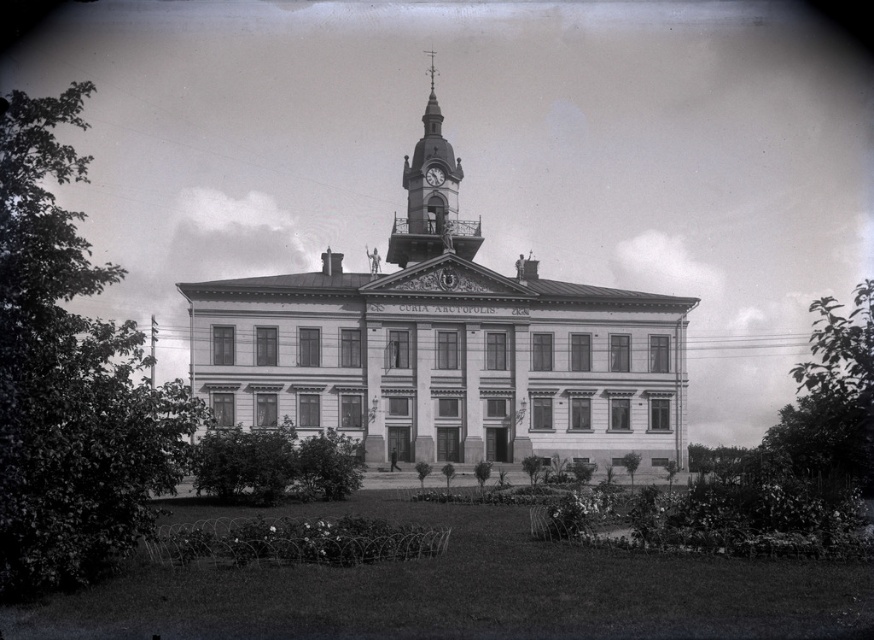
You are standing in front of the historical building and want to locate the smooth metal clock tower at center. According to the coordinates provided, where exactly is it positioned?

The smooth metal clock tower at center is located at coordinates point (431,198).

You are a visitor standing in front of the historical building and want to take a photo of both the smooth metal clock tower at center and the metallic clock at center. However, you notice that one of them is blocking the other. Which object is closer to you, making it block the other?

The smooth metal clock tower at center is in front of the metallic clock at center, so the smooth metal clock tower at center is closer to you and blocks the view of the metallic clock at center.